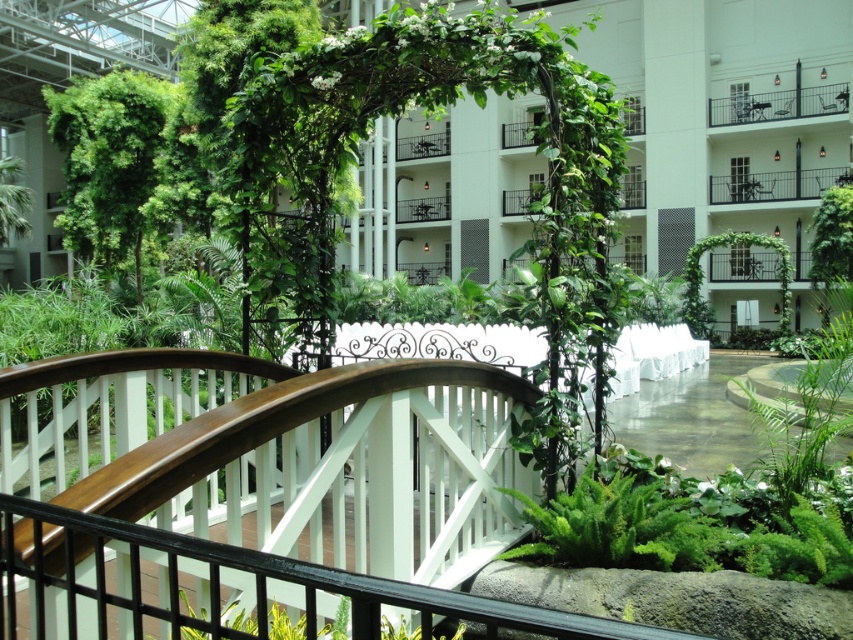
Does white glossy bridge at center have a lesser height compared to wooden bridge at center?

No, white glossy bridge at center is not shorter than wooden bridge at center.

Between point (740, 64) and point (451, 586), which one is positioned behind?

Point (740, 64)

The width and height of the screenshot is (853, 640). Identify the location of white glossy bridge at center. (718, 109).

Does white glossy bridge at center have a greater width compared to black metal balcony at upper center?

Yes, white glossy bridge at center is wider than black metal balcony at upper center.

Between point (769, 65) and point (730, 182), which one is positioned behind?

The point (730, 182) is more distant.

Where is `white glossy bridge at center`? The height and width of the screenshot is (640, 853). white glossy bridge at center is located at coordinates tap(718, 109).

Which is above, wooden bridge at center or black metal balcony at upper center?

black metal balcony at upper center

Can you confirm if wooden bridge at center is shorter than black metal balcony at upper center?

Indeed, wooden bridge at center has a lesser height compared to black metal balcony at upper center.

Is point (85, 378) positioned after point (793, 186)?

No, (85, 378) is closer to viewer.

The height and width of the screenshot is (640, 853). Find the location of `wooden bridge at center`. wooden bridge at center is located at coordinates (282, 454).